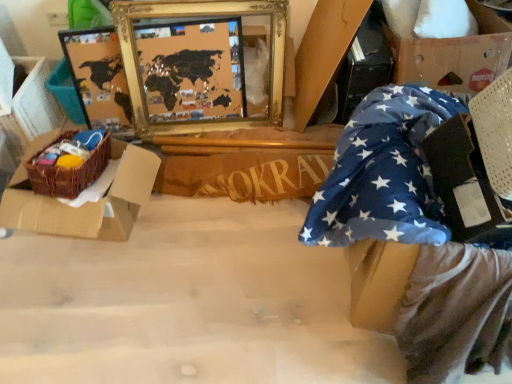
What are the coordinates of `brown woven basket at left` in the screenshot? It's located at (69, 173).

Measure the distance between point (140, 192) and camera.

The distance of point (140, 192) from camera is 4.90 feet.

Describe the element at coordinates (90, 200) in the screenshot. I see `brown woven basket at left` at that location.

The width and height of the screenshot is (512, 384). What are the coordinates of `brown woven basket at left` in the screenshot? It's located at (69, 173).

Which is more to the left, blue star-patterned fabric at lower right or cardboard box at upper right, which ranks as the second cardboard box in left-to-right order?

blue star-patterned fabric at lower right.

From a real-world perspective, which object stands above the other?

cardboard box at upper right, placed as the 1th cardboard box when sorted from right to left.

Looking at this image, how many degrees apart are the facing directions of blue star-patterned fabric at lower right and cardboard box at upper right, which ranks as the second cardboard box in left-to-right order?

66.7 degrees separate the facing orientations of blue star-patterned fabric at lower right and cardboard box at upper right, which ranks as the second cardboard box in left-to-right order.

Looking at this image, from the image's perspective, is blue star-patterned fabric at lower right located beneath cardboard box at upper right, which ranks as the second cardboard box in left-to-right order?

Correct, blue star-patterned fabric at lower right appears lower than cardboard box at upper right, which ranks as the second cardboard box in left-to-right order, in the image.

In the scene shown: Who is bigger, brown woven basket at left or cardboard box at upper right, which ranks as the second cardboard box in left-to-right order?

With larger size is cardboard box at upper right, which ranks as the second cardboard box in left-to-right order.

Is brown woven basket at left not within cardboard box at upper right, placed as the 1th cardboard box when sorted from right to left?

brown woven basket at left is positioned outside cardboard box at upper right, placed as the 1th cardboard box when sorted from right to left.

Measure the distance from brown woven basket at left to cardboard box at upper right, which ranks as the second cardboard box in left-to-right order.

brown woven basket at left and cardboard box at upper right, which ranks as the second cardboard box in left-to-right order, are 1.30 meters apart.

Is brown woven basket at left facing towards cardboard box at upper right, which ranks as the second cardboard box in left-to-right order?

No.

Is point (48, 230) closer or farther from the camera than point (372, 151)?

Clearly, point (48, 230) is more distant from the camera than point (372, 151).

In terms of height, does brown woven basket at left look taller or shorter compared to blue star-patterned fabric at lower right?

In the image, brown woven basket at left appears to be shorter than blue star-patterned fabric at lower right.

Is there a large distance between brown woven basket at left and blue star-patterned fabric at lower right?

That's not correct — brown woven basket at left is a little close to blue star-patterned fabric at lower right.

Does brown woven basket at left come behind blue star-patterned fabric at lower right?

Yes, brown woven basket at left is further from the camera.

Is blue fabric at right, placed as the second cardboard box when sorted from right to left, positioned far away from cardboard box at upper right, which ranks as the second cardboard box in left-to-right order?

blue fabric at right, placed as the second cardboard box when sorted from right to left, is near cardboard box at upper right, which ranks as the second cardboard box in left-to-right order, not far away.

Relative to cardboard box at upper right, which ranks as the second cardboard box in left-to-right order, is blue fabric at right, placed as the second cardboard box when sorted from right to left, in front or behind?

Clearly, blue fabric at right, placed as the second cardboard box when sorted from right to left, is behind cardboard box at upper right, which ranks as the second cardboard box in left-to-right order.

Is blue fabric at right, placed as the second cardboard box when sorted from right to left, taller than cardboard box at upper right, which ranks as the second cardboard box in left-to-right order?

Correct, blue fabric at right, placed as the second cardboard box when sorted from right to left, is much taller as cardboard box at upper right, which ranks as the second cardboard box in left-to-right order.

Considering the points (354, 22) and (480, 18), which point is in front, point (354, 22) or point (480, 18)?

Point (354, 22)

From a real-world perspective, relative to blue fabric at right, placed as the 1th cardboard box when sorted from left to right, is cardboard box at upper right, which ranks as the second cardboard box in left-to-right order, vertically above or below?

Clearly, from a real-world perspective, cardboard box at upper right, which ranks as the second cardboard box in left-to-right order, is above blue fabric at right, placed as the 1th cardboard box when sorted from left to right.

Is cardboard box at upper right, which ranks as the second cardboard box in left-to-right order, wider than blue fabric at right, placed as the 1th cardboard box when sorted from left to right?

No, cardboard box at upper right, which ranks as the second cardboard box in left-to-right order, is not wider than blue fabric at right, placed as the 1th cardboard box when sorted from left to right.

Measure the distance from cardboard box at upper right, placed as the 1th cardboard box when sorted from right to left, to blue fabric at right, placed as the 1th cardboard box when sorted from left to right.

They are 35.28 centimeters apart.

From the image's perspective, which object appears higher, cardboard box at upper right, which ranks as the second cardboard box in left-to-right order, or blue fabric at right, placed as the second cardboard box when sorted from right to left?

cardboard box at upper right, which ranks as the second cardboard box in left-to-right order, from the image's perspective.

Which object is thinner, cardboard box at upper right, placed as the 1th cardboard box when sorted from right to left, or wooden sign at center?

wooden sign at center is thinner.

Is cardboard box at upper right, which ranks as the second cardboard box in left-to-right order, positioned far away from wooden sign at center?

They are positioned close to each other.

Does point (492, 35) come in front of point (326, 173)?

Yes, it is.

From the image's perspective, relative to wooden sign at center, is cardboard box at upper right, placed as the 1th cardboard box when sorted from right to left, above or below?

cardboard box at upper right, placed as the 1th cardboard box when sorted from right to left, is situated higher than wooden sign at center in the image.

Does gold-framed map at upper center have a smaller size compared to cardboard box at upper right, placed as the 1th cardboard box when sorted from right to left?

Yes.

From the image's perspective, is gold-framed map at upper center above cardboard box at upper right, placed as the 1th cardboard box when sorted from right to left?

No.

Does gold-framed map at upper center appear on the left side of cardboard box at upper right, which ranks as the second cardboard box in left-to-right order?

Indeed, gold-framed map at upper center is positioned on the left side of cardboard box at upper right, which ranks as the second cardboard box in left-to-right order.

Image resolution: width=512 pixels, height=384 pixels. I want to click on person beneath the cardboard box at upper right, placed as the 1th cardboard box when sorted from right to left (from a real-world perspective), so click(412, 242).

Locate an element on the screen. The image size is (512, 384). the 1st cardboard box behind the brown woven basket at left is located at coordinates (455, 56).

Estimate the real-world distances between objects in this image. Which object is further from brown woven basket at left, blue fabric at right, placed as the 1th cardboard box when sorted from left to right, or wooden sign at center?

Among the two, blue fabric at right, placed as the 1th cardboard box when sorted from left to right, is located further to brown woven basket at left.

Based on their spatial positions, is gold-framed map at upper center or blue fabric at right, placed as the second cardboard box when sorted from right to left, further from brown woven basket at left?

blue fabric at right, placed as the second cardboard box when sorted from right to left.

Looking at the image, which one is located further to brown woven basket at left, blue star-patterned fabric at lower right or gold-framed map at upper center?

blue star-patterned fabric at lower right lies further to brown woven basket at left than the other object.

Looking at the image, which one is located closer to brown woven basket at left, blue fabric at right, placed as the 1th cardboard box when sorted from left to right, or brown woven basket at left?

Based on the image, brown woven basket at left appears to be nearer to brown woven basket at left.

Based on their spatial positions, is brown woven basket at left or cardboard box at upper right, placed as the 1th cardboard box when sorted from right to left, closer to brown woven basket at left?

brown woven basket at left.

Looking at the image, which one is located further to gold-framed map at upper center, blue fabric at right, placed as the second cardboard box when sorted from right to left, or cardboard box at upper right, placed as the 1th cardboard box when sorted from right to left?

cardboard box at upper right, placed as the 1th cardboard box when sorted from right to left, is positioned further to the anchor gold-framed map at upper center.

Looking at the image, which one is located further to wooden sign at center, brown woven basket at left or gold-framed map at upper center?

brown woven basket at left.

When comparing their distances from gold-framed map at upper center, does cardboard box at upper right, placed as the 1th cardboard box when sorted from right to left, or brown woven basket at left seem further?

Based on the image, cardboard box at upper right, placed as the 1th cardboard box when sorted from right to left, appears to be further to gold-framed map at upper center.

What are the coordinates of `cardboard box between brown woven basket at left and blue star-patterned fabric at lower right in the horizontal direction` in the screenshot? It's located at (323, 51).

The width and height of the screenshot is (512, 384). Find the location of `picture frame between blue star-patterned fabric at lower right and wooden sign at center from front to back`. picture frame between blue star-patterned fabric at lower right and wooden sign at center from front to back is located at coordinates (202, 19).

The width and height of the screenshot is (512, 384). I want to click on box located between brown woven basket at left and blue fabric at right, placed as the 1th cardboard box when sorted from left to right, in the left-right direction, so click(x=90, y=200).

The height and width of the screenshot is (384, 512). Identify the location of crate between gold-framed map at upper center and brown woven basket at left in the vertical direction. (69, 173).